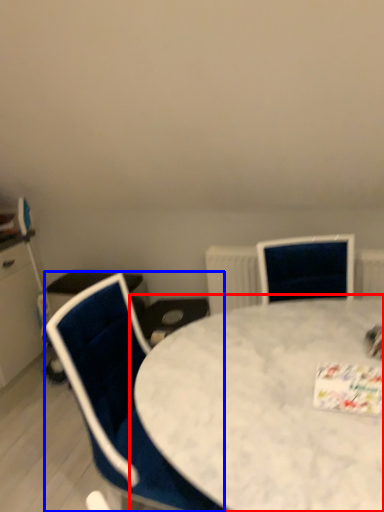
Question: Which point is closer to the camera, table (highlighted by a red box) or chair (highlighted by a blue box)?

Choices:
 (A) table
 (B) chair

Answer: (A)